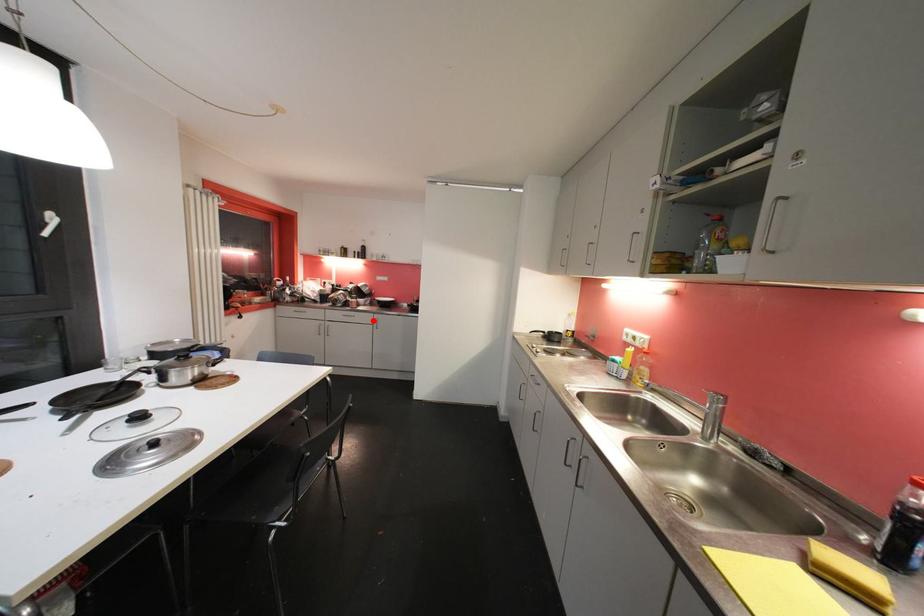
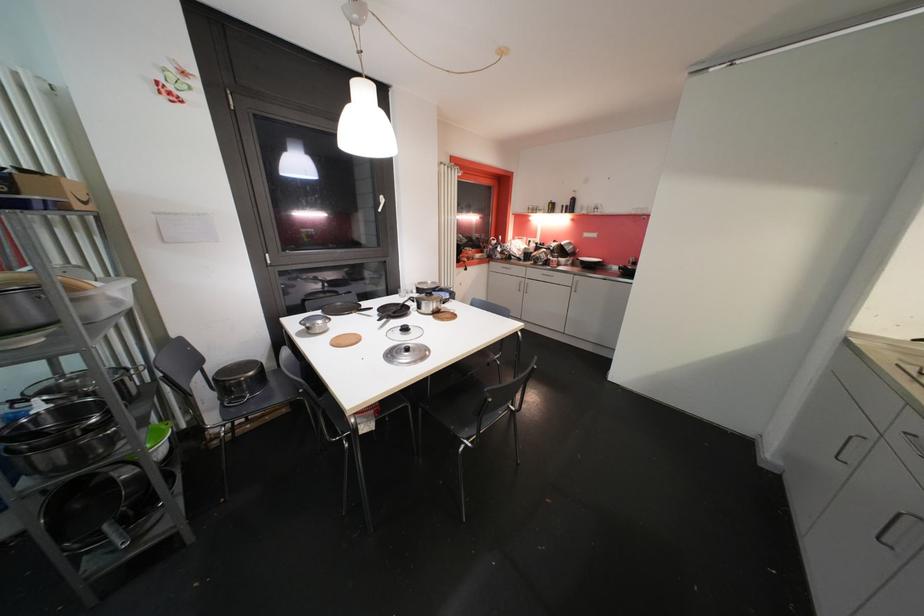
Where in the second image is the point corresponding to the highlighted location from the first image?

(572, 282)